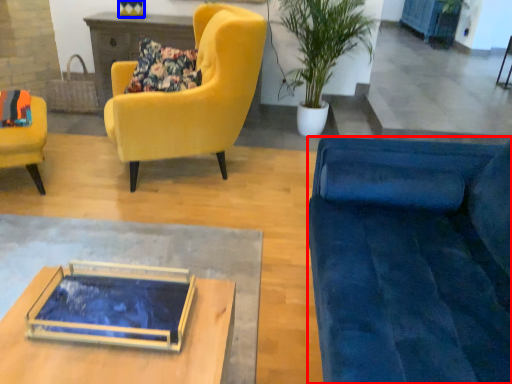
Question: Which of the following is the farthest to the observer, studio couch (highlighted by a red box) or vase (highlighted by a blue box)?

Choices:
 (A) studio couch
 (B) vase

Answer: (B)